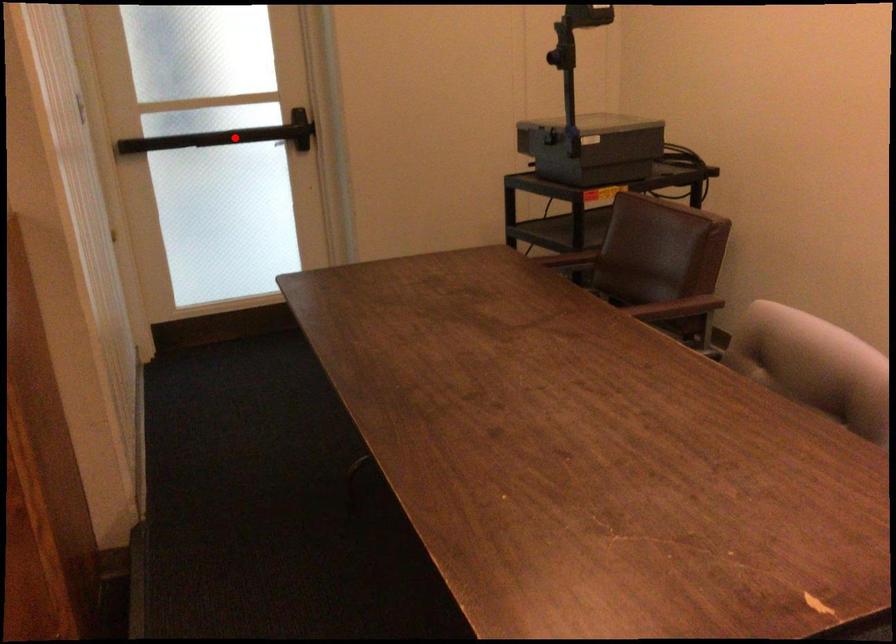
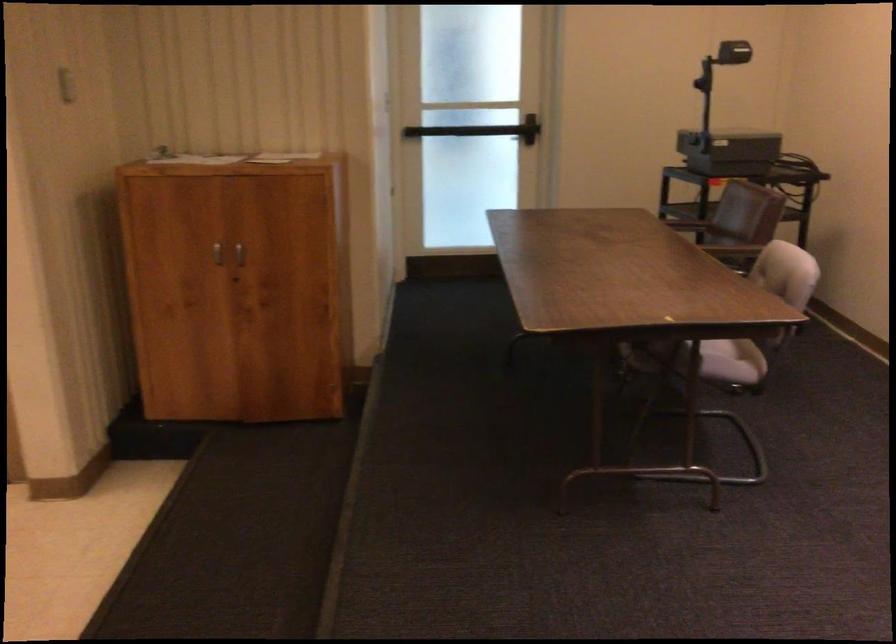
The point at the highlighted location is marked in the first image. Where is the corresponding point in the second image?

(479, 129)